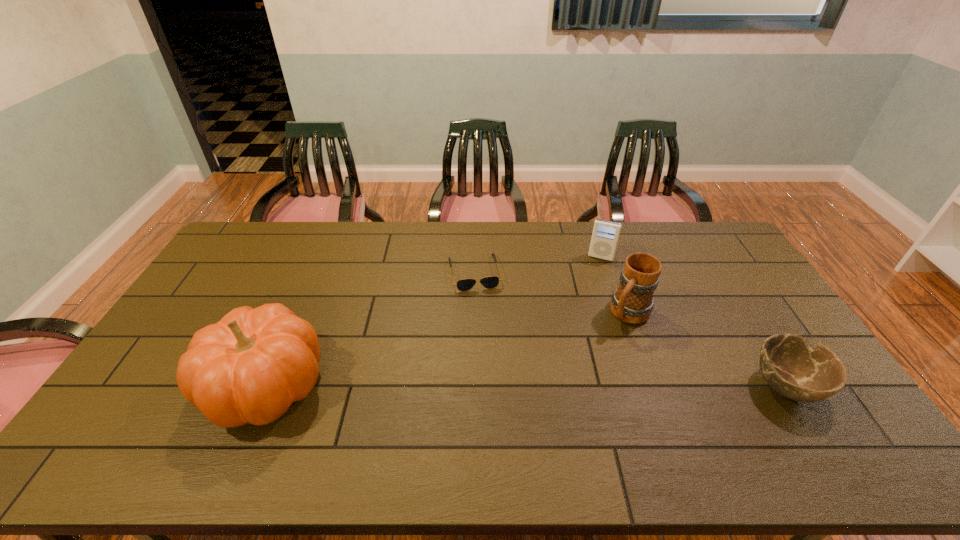
Find the location of `sunglasses positioned at the far edge`. sunglasses positioned at the far edge is located at coordinates (490, 282).

Where is `iPod that is at the far edge`? This screenshot has height=540, width=960. iPod that is at the far edge is located at coordinates (605, 235).

Locate an element on the screen. pumpkin at the near edge is located at coordinates point(249,367).

Identify the location of bowl that is at the near edge. The image size is (960, 540). (790, 366).

The image size is (960, 540). Identify the location of object present at the right edge. (790, 366).

Identify the location of object at the near right corner. The height and width of the screenshot is (540, 960). (790, 366).

This screenshot has width=960, height=540. I want to click on free spot at the far edge of the desktop, so click(314, 241).

In the image, there is a desktop. Where is `free space at the near edge`? The image size is (960, 540). free space at the near edge is located at coordinates 794,427.

Locate an element on the screen. vacant space at the left edge of the desktop is located at coordinates (256, 260).

The image size is (960, 540). I want to click on free space between the shortest object and the leftmost object, so click(x=371, y=329).